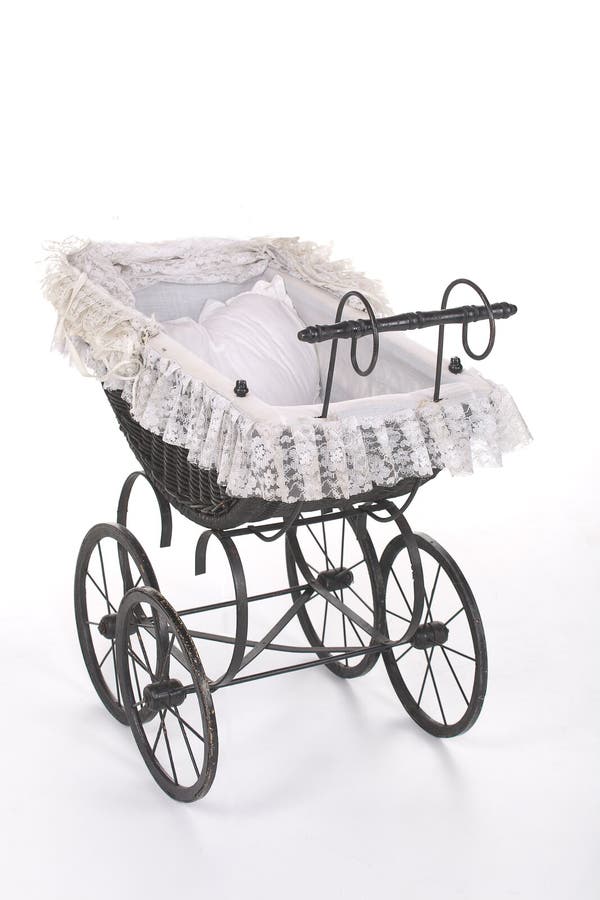
The image size is (600, 900). Identify the location of lace trim. (362, 454), (174, 394), (328, 256), (148, 255).